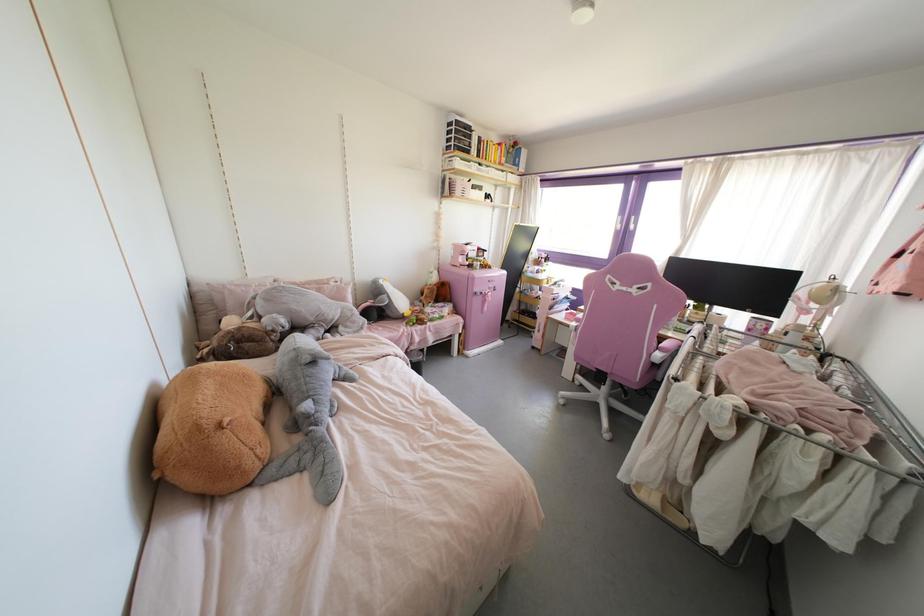
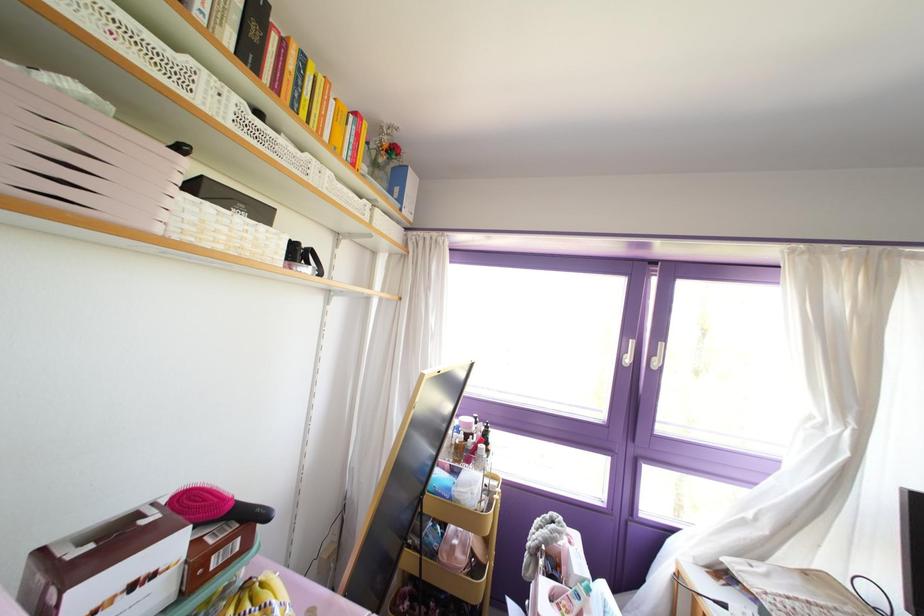
In the second image, find the point that corresponds to pixel 506 152 in the first image.

(372, 163)